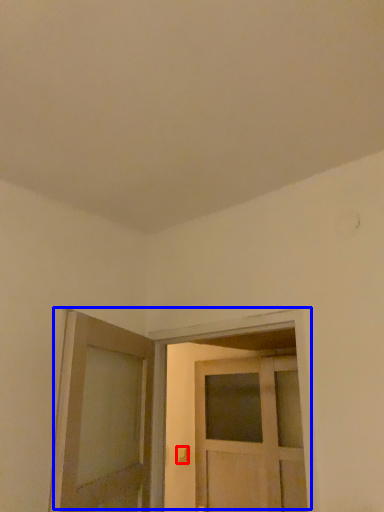
Question: Which object is closer to the camera taking this photo, door handle (highlighted by a red box) or door (highlighted by a blue box)?

Choices:
 (A) door handle
 (B) door

Answer: (B)